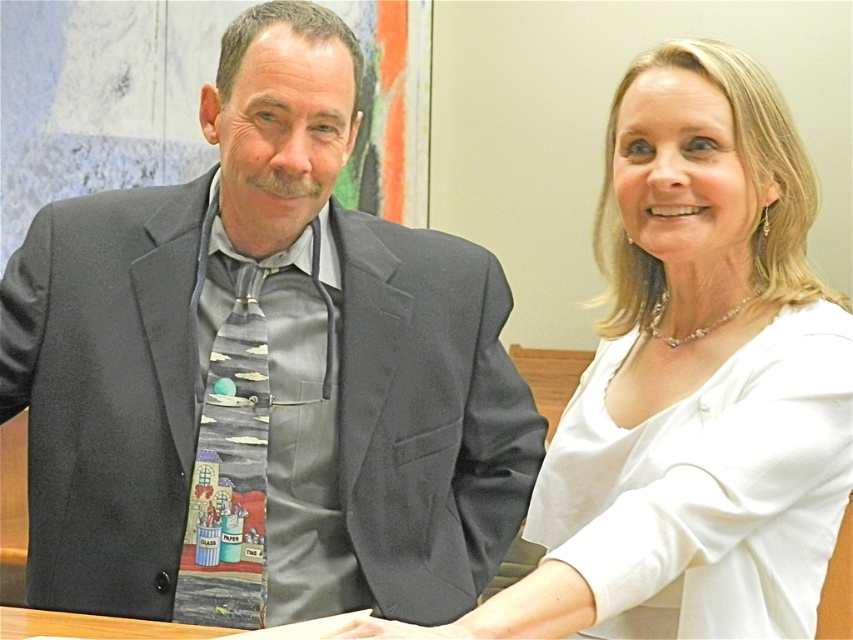
Question: Does white satin blouse at center appear on the left side of wooden table at lower center?

Choices:
 (A) no
 (B) yes

Answer: (A)

Question: Is matte gray suit at left to the left of wooden table at lower center from the viewer's perspective?

Choices:
 (A) no
 (B) yes

Answer: (A)

Question: Which is farther from the white satin blouse at center?

Choices:
 (A) matte gray suit at left
 (B) wooden table at lower center

Answer: (B)

Question: From the image, what is the correct spatial relationship of white satin blouse at center in relation to wooden table at lower center?

Choices:
 (A) above
 (B) below

Answer: (A)

Question: Among these objects, which one is nearest to the camera?

Choices:
 (A) wooden table at lower center
 (B) white satin blouse at center

Answer: (B)

Question: Which of the following is the farthest from the observer?

Choices:
 (A) (62, 616)
 (B) (654, 502)

Answer: (A)